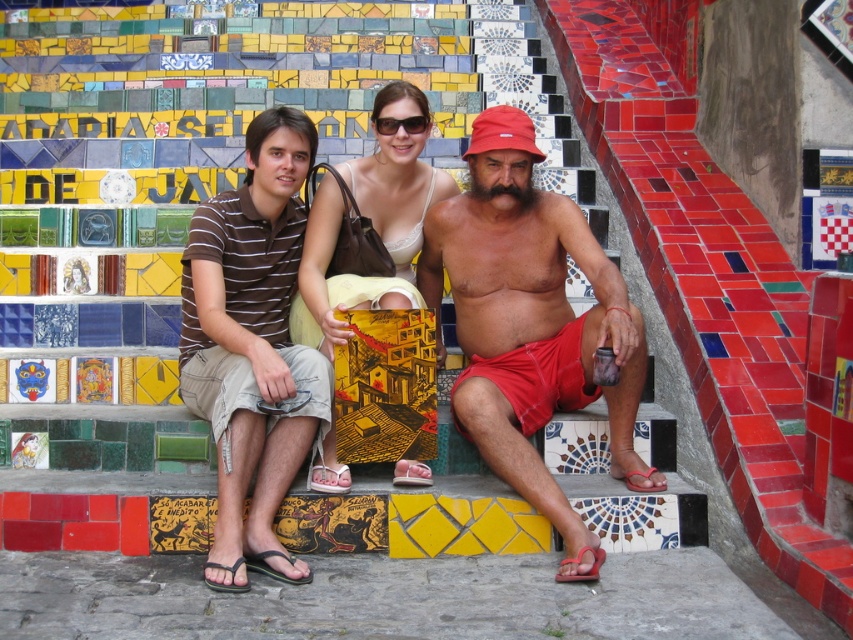
You are an artist planning to paint a portrait of the individuals sitting on the staircase. You need to ensure the proportions are accurate. Which object from the scene, the matte brown shirt at center or the matte red shorts at center, should you make larger in your painting to maintain correct proportions?

The matte brown shirt at center should be made larger in the painting since it is much taller than the matte red shorts at center according to the scene description.

You are standing on the staircase and want to hand a gift to the person wearing the brown striped shirt at left without disturbing the person in matte red shorts at center. Which direction should you approach from?

You should approach from the left side of the brown striped shirt at left because the matte red shorts at center are to the right of the brown striped shirt at left, so approaching from the left would avoid disturbing them.

You are standing at the bottom of the staircase and want to hand a gift to the person wearing the matte brown shirt at center. Where should you aim to place the gift so it reaches them?

You should aim to place the gift at the 2D location point (531,323) where the matte brown shirt at center is located.